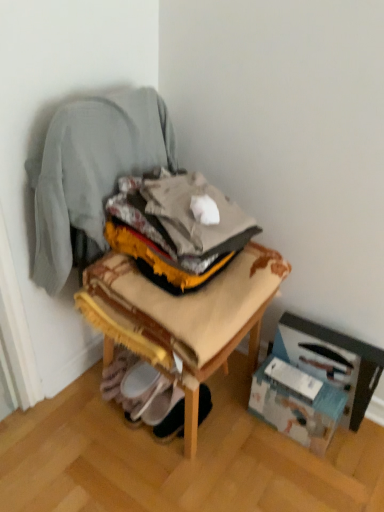
Identify the location of vacant area that is situated to the right of teal cardboard box at lower right, which is the 2th cardboard box in right-to-left order. The height and width of the screenshot is (512, 384). (361, 446).